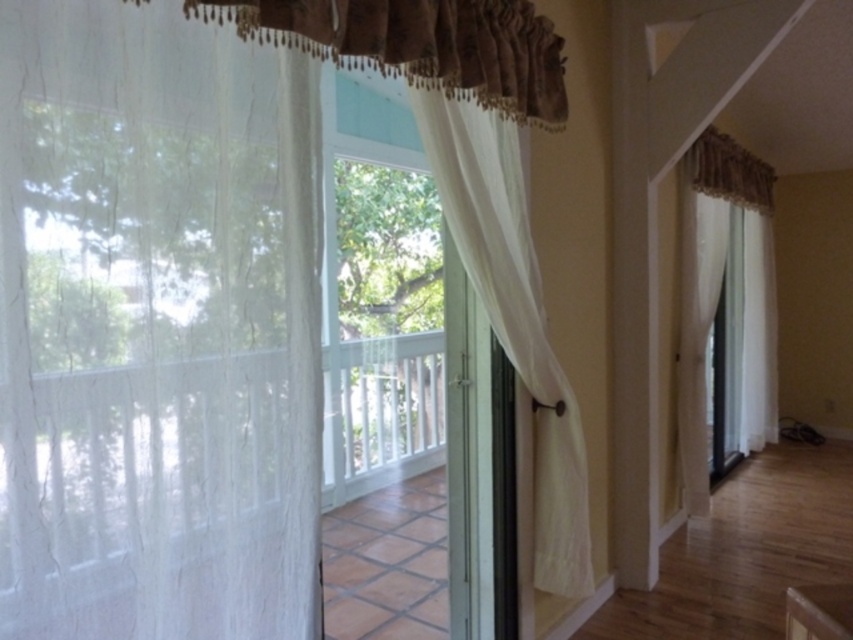
You are standing in the living room and want to check the position of the white sheer curtain at left. What are its coordinates?

The white sheer curtain at left is located at point (155,326).